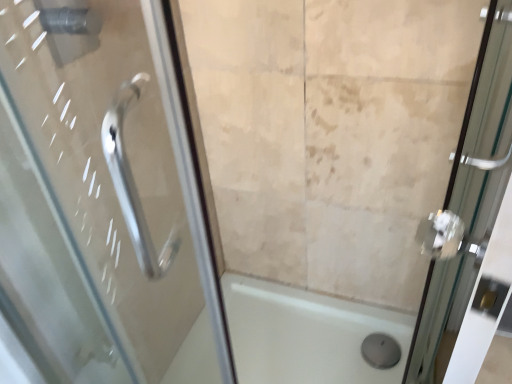
Question: From their relative heights in the image, would you say white glossy bath at center is taller or shorter than clear glass door at right?

Choices:
 (A) tall
 (B) short

Answer: (B)

Question: Relative to clear glass door at right, is white glossy bath at center in front or behind?

Choices:
 (A) front
 (B) behind

Answer: (B)

Question: From a real-world perspective, is white glossy bath at center physically located above or below clear glass door at right?

Choices:
 (A) below
 (B) above

Answer: (A)

Question: Is point (471, 145) closer or farther from the camera than point (241, 369)?

Choices:
 (A) closer
 (B) farther

Answer: (A)

Question: Relative to white glossy bath at center, is clear glass door at right in front or behind?

Choices:
 (A) front
 (B) behind

Answer: (A)

Question: From the image's perspective, is clear glass door at right positioned above or below white glossy bath at center?

Choices:
 (A) above
 (B) below

Answer: (A)

Question: Looking at the image, does clear glass door at right seem bigger or smaller compared to white glossy bath at center?

Choices:
 (A) small
 (B) big

Answer: (B)